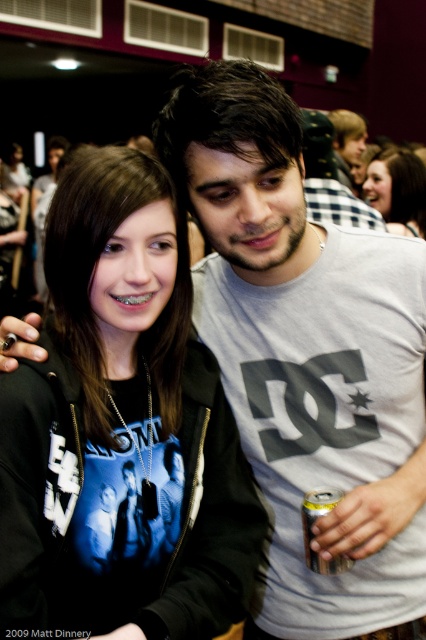
Question: Can you confirm if gray cotton t-shirt at upper right is positioned below silver metallic can at lower center?

Choices:
 (A) yes
 (B) no

Answer: (B)

Question: Which object is the closest to the matte black hoodie at upper right?

Choices:
 (A) black matte hoodie at center
 (B) silver metallic can at lower center
 (C) gray cotton t-shirt at upper right

Answer: (C)

Question: Is matte black hoodie at upper right wider than gray cotton t-shirt at upper right?

Choices:
 (A) yes
 (B) no

Answer: (B)

Question: Does black matte hoodie at center appear on the right side of silver metallic can at lower center?

Choices:
 (A) no
 (B) yes

Answer: (A)

Question: Which object is positioned closest to the matte black hoodie at upper right?

Choices:
 (A) gray cotton t-shirt at upper right
 (B) silver metallic can at lower center

Answer: (A)

Question: Which point is farther to the camera?

Choices:
 (A) (334, 109)
 (B) (319, 513)
 (C) (235, 508)

Answer: (A)